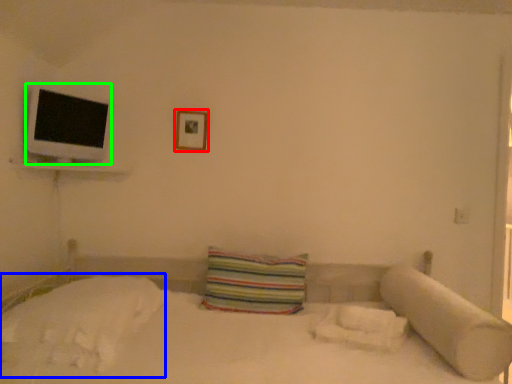
Question: Based on their relative distances, which object is nearer to picture frame (highlighted by a red box)? Choose from sheet (highlighted by a blue box) and flat (highlighted by a green box).

Choices:
 (A) sheet
 (B) flat

Answer: (B)